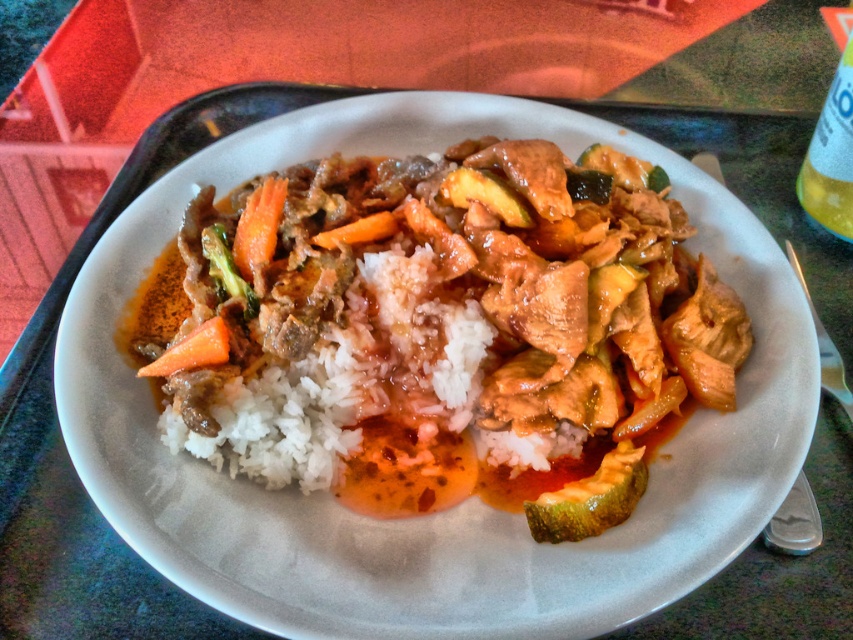
Consider the image. You are a food critic observing the plate of food. You notice two green vegetables at the center of the plate. Which one is closer to you, the green matte cucumber at center or the green glossy broccoli at center?

The green matte cucumber at center is closer to the viewer than the green glossy broccoli at center, so the green matte cucumber at center is closer to you.